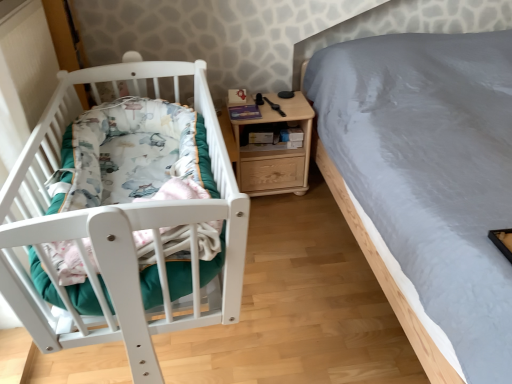
This screenshot has height=384, width=512. What do you see at coordinates (116, 228) in the screenshot? I see `white matte crib at left` at bounding box center [116, 228].

You are a GUI agent. You are given a task and a screenshot of the screen. Output one action in this format:
    pyautogui.click(x=<x>, y=<y>)
    Task: Click on the white matte crib at left
    This screenshot has width=512, height=384.
    Given the screenshot: What is the action you would take?
    pyautogui.click(x=116, y=228)

The width and height of the screenshot is (512, 384). In order to click on light wood/texture nightstand at center in this screenshot , I will do `click(273, 150)`.

What do you see at coordinates (273, 150) in the screenshot?
I see `light wood/texture nightstand at center` at bounding box center [273, 150].

In order to face light wood/texture nightstand at center, should I rotate leftwards or rightwards?

Turn right approximately 1.486 degrees to face it.

Where is `white matte crib at left`? The image size is (512, 384). white matte crib at left is located at coordinates (116, 228).

Which object is positioned more to the right, light wood/texture nightstand at center or white matte crib at left?

light wood/texture nightstand at center.

Which object is more forward, light wood/texture nightstand at center or white matte crib at left?

white matte crib at left is in front.

Considering the positions of points (267, 147) and (233, 292), is point (267, 147) closer to camera compared to point (233, 292)?

No, (267, 147) is further to viewer.

From the image's perspective, is light wood/texture nightstand at center on white matte crib at left?

Yes, from the image's perspective, light wood/texture nightstand at center is over white matte crib at left.

From a real-world perspective, is light wood/texture nightstand at center positioned under white matte crib at left based on gravity?

Correct, in the physical world, light wood/texture nightstand at center is lower than white matte crib at left.

Considering the sizes of objects light wood/texture nightstand at center and white matte crib at left in the image provided, who is thinner, light wood/texture nightstand at center or white matte crib at left?

light wood/texture nightstand at center.

Between light wood/texture nightstand at center and white matte crib at left, which one has less height?

white matte crib at left is shorter.

Who is bigger, light wood/texture nightstand at center or white matte crib at left?

Bigger between the two is white matte crib at left.

Would you say light wood/texture nightstand at center contains white matte crib at left?

Actually, white matte crib at left is outside light wood/texture nightstand at center.

Can you see light wood/texture nightstand at center touching white matte crib at left?

They are not placed beside each other.

Is light wood/texture nightstand at center positioned with its back to white matte crib at left?

No, light wood/texture nightstand at center is not facing away from white matte crib at left.

How many degrees apart are the facing directions of light wood/texture nightstand at center and white matte crib at left?

They differ by 90.7 degrees in their facing directions.

How much distance is there between light wood/texture nightstand at center and white matte crib at left?

The distance of light wood/texture nightstand at center from white matte crib at left is 32.64 inches.

The image size is (512, 384). Identify the location of infant bed in front of the light wood/texture nightstand at center. (116, 228).

Considering the relative positions of white matte crib at left and light wood/texture nightstand at center in the image provided, is white matte crib at left to the left of light wood/texture nightstand at center from the viewer's perspective?

Indeed, white matte crib at left is positioned on the left side of light wood/texture nightstand at center.

Which object is further away from the camera taking this photo, white matte crib at left or light wood/texture nightstand at center?

light wood/texture nightstand at center.

Is point (52, 108) closer or farther from the camera than point (310, 145)?

Point (52, 108) is positioned closer to the camera compared to point (310, 145).

From the image's perspective, is white matte crib at left under light wood/texture nightstand at center?

Yes.

From a real-world perspective, between white matte crib at left and light wood/texture nightstand at center, who is vertically lower?

light wood/texture nightstand at center is physically lower.

From the picture: Is white matte crib at left wider than light wood/texture nightstand at center?

Yes.

Is white matte crib at left taller or shorter than light wood/texture nightstand at center?

Clearly, white matte crib at left is shorter compared to light wood/texture nightstand at center.

Who is smaller, white matte crib at left or light wood/texture nightstand at center?

light wood/texture nightstand at center.

Do you think white matte crib at left is within light wood/texture nightstand at center, or outside of it?

white matte crib at left is outside light wood/texture nightstand at center.

Are white matte crib at left and light wood/texture nightstand at center located far from each other?

No, white matte crib at left is in close proximity to light wood/texture nightstand at center.

Could you tell me if white matte crib at left is facing light wood/texture nightstand at center?

No, white matte crib at left does not turn towards light wood/texture nightstand at center.

Based on the photo, measure the distance from white matte crib at left to light wood/texture nightstand at center.

white matte crib at left and light wood/texture nightstand at center are 82.91 centimeters apart.

Where is `infant bed below the light wood/texture nightstand at center (from the image's perspective)`? infant bed below the light wood/texture nightstand at center (from the image's perspective) is located at coordinates (116, 228).

Where is `nightstand that is under the white matte crib at left (from a real-world perspective)`? This screenshot has height=384, width=512. nightstand that is under the white matte crib at left (from a real-world perspective) is located at coordinates (273, 150).

At what (x,y) coordinates should I click in order to perform the action: click on nightstand on the right of white matte crib at left. Please return your answer as a coordinate pair (x, y). Image resolution: width=512 pixels, height=384 pixels. Looking at the image, I should click on (273, 150).